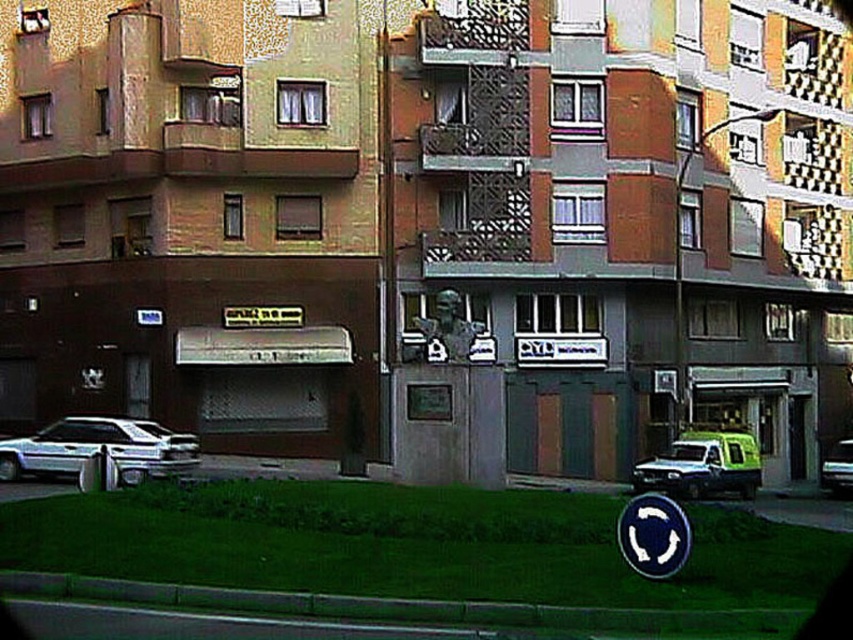
You are standing at the center of the roundabout in front of the residential building. You see a point marked at coordinates (x=97, y=449). What object is located at that point?

The point at coordinates (x=97, y=449) corresponds to the white glossy car at lower left.

You are driving a car that is 5 meters long and want to park in the space between the white glossy car at lower left and the blue metallic circle at center. Can your car fit in that space?

The distance between the white glossy car at lower left and the blue metallic circle at center is 18.11 meters. Since your car is only 5 meters long, there is sufficient space for it to fit comfortably in the available parking area.

You are driving a car and need to park in the space between the white glossy car at lower left and the blue metallic circle at center. Can your car fit there if your car is 1.8 meters wide?

The white glossy car at lower left might be wider than blue metallic circle at center, so the available space between them could be narrower than the car width. It is uncertain if your car can fit there.